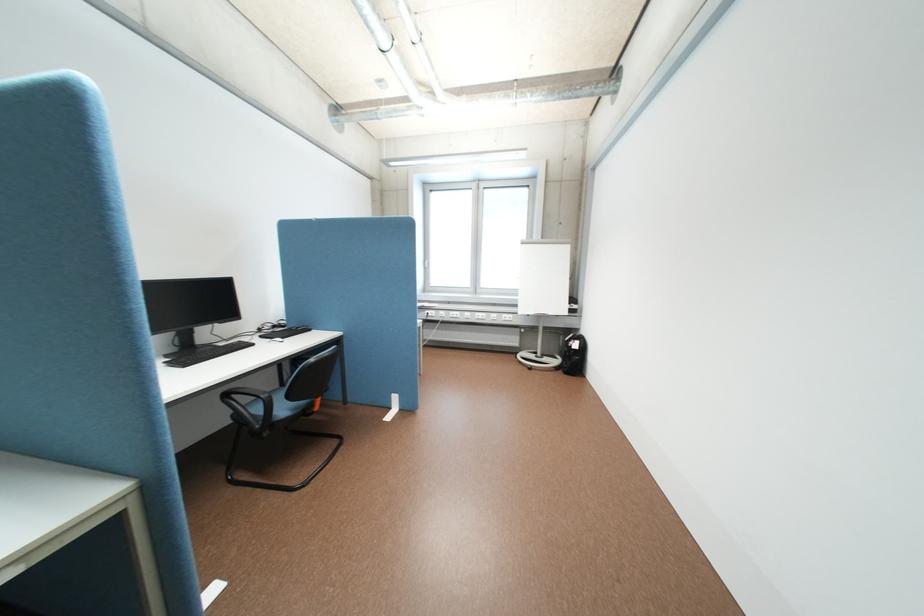
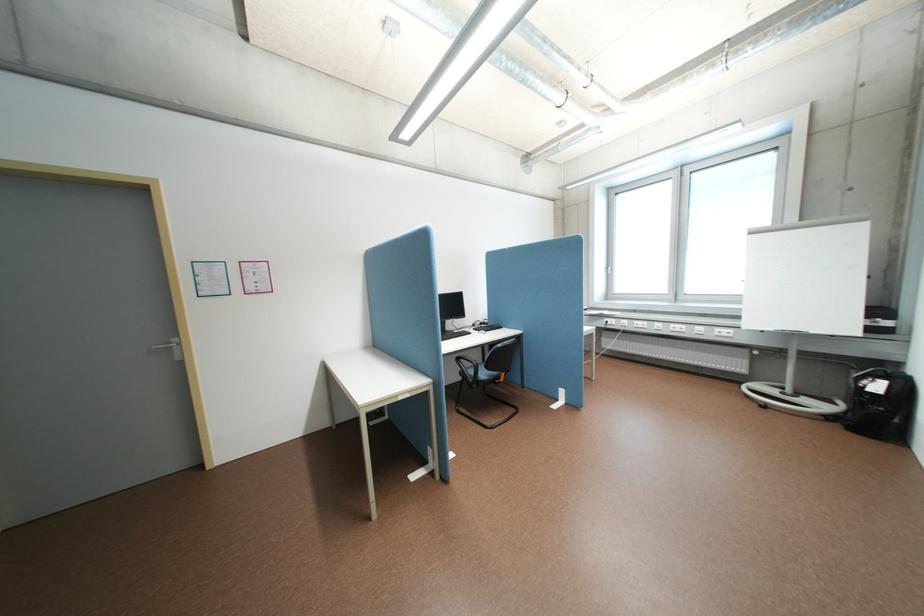
Find the pixel in the second image that matches pixel 237 395 in the first image.

(468, 359)